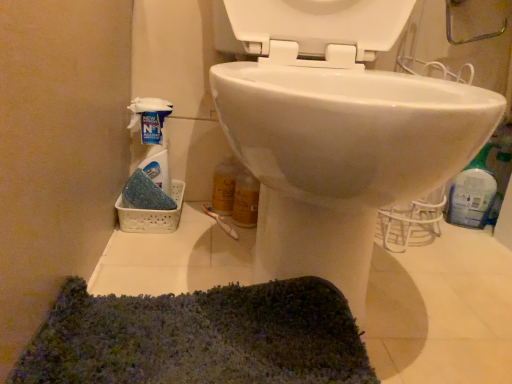
Locate an element on the screen. blue plastic bottle at right, which is counted as the 1th cleaning product, starting from the right is located at coordinates [x=472, y=193].

I want to click on white glossy toilet at center, so click(x=337, y=132).

In terms of width, does blue plastic bottle at right, which appears as the second cleaning product when viewed from the left, look wider or thinner when compared to white glossy toilet at center?

Clearly, blue plastic bottle at right, which appears as the second cleaning product when viewed from the left, has less width compared to white glossy toilet at center.

Which of these two, blue plastic bottle at right, which is counted as the 1th cleaning product, starting from the right, or white glossy toilet at center, is smaller?

blue plastic bottle at right, which is counted as the 1th cleaning product, starting from the right.

Visually, is blue plastic bottle at right, which appears as the second cleaning product when viewed from the left, positioned to the left or to the right of white glossy toilet at center?

Clearly, blue plastic bottle at right, which appears as the second cleaning product when viewed from the left, is on the right of white glossy toilet at center in the image.

Who is smaller, white plastic spray bottle at left, which is the second cleaning product in right-to-left order, or blue plastic bottle at right, which is counted as the 1th cleaning product, starting from the right?

With smaller size is white plastic spray bottle at left, which is the second cleaning product in right-to-left order.

Does white plastic spray bottle at left, the first cleaning product positioned from the left, have a lesser width compared to blue plastic bottle at right, which is counted as the 1th cleaning product, starting from the right?

Yes.

From a real-world perspective, is white plastic spray bottle at left, the first cleaning product positioned from the left, physically located above or below blue plastic bottle at right, which is counted as the 1th cleaning product, starting from the right?

Clearly, from a real-world perspective, white plastic spray bottle at left, the first cleaning product positioned from the left, is below blue plastic bottle at right, which is counted as the 1th cleaning product, starting from the right.

Does white plastic spray bottle at left, which is the second cleaning product in right-to-left order, turn towards blue plastic bottle at right, which is counted as the 1th cleaning product, starting from the right?

No, white plastic spray bottle at left, which is the second cleaning product in right-to-left order, does not turn towards blue plastic bottle at right, which is counted as the 1th cleaning product, starting from the right.

From a real-world perspective, which is physically above, blue plastic bottle at right, which is counted as the 1th cleaning product, starting from the right, or white plastic spray bottle at left, which is the second cleaning product in right-to-left order?

In real-world perspective, blue plastic bottle at right, which is counted as the 1th cleaning product, starting from the right, is above.

Is blue plastic bottle at right, which appears as the second cleaning product when viewed from the left, oriented towards white plastic spray bottle at left, which is the second cleaning product in right-to-left order?

No.

Find the location of `cleaning product below the white plastic spray bottle at left, which is the second cleaning product in right-to-left order (from the image's perspective)`. cleaning product below the white plastic spray bottle at left, which is the second cleaning product in right-to-left order (from the image's perspective) is located at coordinates (472, 193).

Does point (328, 279) appear closer or farther from the camera than point (463, 217)?

Point (328, 279) is positioned closer to the camera compared to point (463, 217).

Is white glossy toilet at center directly adjacent to blue plastic bottle at right, which is counted as the 1th cleaning product, starting from the right?

white glossy toilet at center is not next to blue plastic bottle at right, which is counted as the 1th cleaning product, starting from the right, and they're not touching.

From the image's perspective, is white glossy toilet at center under blue plastic bottle at right, which appears as the second cleaning product when viewed from the left?

No.

Considering the relative sizes of white glossy toilet at center and blue plastic bottle at right, which appears as the second cleaning product when viewed from the left, in the image provided, is white glossy toilet at center thinner than blue plastic bottle at right, which appears as the second cleaning product when viewed from the left,?

Incorrect, the width of white glossy toilet at center is not less than that of blue plastic bottle at right, which appears as the second cleaning product when viewed from the left.

From the picture: Looking at the image, does white glossy toilet at center seem bigger or smaller compared to white plastic spray bottle at left, the first cleaning product positioned from the left?

Considering their sizes, white glossy toilet at center takes up more space than white plastic spray bottle at left, the first cleaning product positioned from the left.

In the image, is white glossy toilet at center positioned in front of or behind white plastic spray bottle at left, the first cleaning product positioned from the left?

Clearly, white glossy toilet at center is in front of white plastic spray bottle at left, the first cleaning product positioned from the left.

In the scene shown: Would you consider white glossy toilet at center to be distant from white plastic spray bottle at left, which is the second cleaning product in right-to-left order?

No, white glossy toilet at center is not far away from white plastic spray bottle at left, which is the second cleaning product in right-to-left order.

The height and width of the screenshot is (384, 512). I want to click on toilet that appears in front of the white plastic spray bottle at left, the first cleaning product positioned from the left, so click(337, 132).

Between white plastic spray bottle at left, which is the second cleaning product in right-to-left order, and white glossy toilet at center, which one has smaller size?

white plastic spray bottle at left, which is the second cleaning product in right-to-left order.

Does white plastic spray bottle at left, the first cleaning product positioned from the left, touch white glossy toilet at center?

white plastic spray bottle at left, the first cleaning product positioned from the left, is not next to white glossy toilet at center, and they're not touching.

From the image's perspective, is white plastic spray bottle at left, the first cleaning product positioned from the left, positioned above or below white glossy toilet at center?

From the image's perspective, white plastic spray bottle at left, the first cleaning product positioned from the left, appears below white glossy toilet at center.

From the white glossy toilet at center, count 2nd cleaning products backward and point to it. Please provide its 2D coordinates.

[(472, 193)]

The image size is (512, 384). What are the coordinates of `cleaning product on the left of blue plastic bottle at right, which is counted as the 1th cleaning product, starting from the right` in the screenshot? It's located at (151, 139).

Based on their spatial positions, is blue plastic bottle at right, which is counted as the 1th cleaning product, starting from the right, or white plastic spray bottle at left, which is the second cleaning product in right-to-left order, closer to white glossy toilet at center?

white plastic spray bottle at left, which is the second cleaning product in right-to-left order.

Looking at the image, which one is located closer to white glossy toilet at center, white plastic spray bottle at left, which is the second cleaning product in right-to-left order, or blue plastic bottle at right, which is counted as the 1th cleaning product, starting from the right?

white plastic spray bottle at left, which is the second cleaning product in right-to-left order, is closer to white glossy toilet at center.

When comparing their distances from white plastic spray bottle at left, the first cleaning product positioned from the left, does white glossy toilet at center or blue plastic bottle at right, which is counted as the 1th cleaning product, starting from the right, seem closer?

Based on the image, white glossy toilet at center appears to be nearer to white plastic spray bottle at left, the first cleaning product positioned from the left.

When comparing their distances from blue plastic bottle at right, which is counted as the 1th cleaning product, starting from the right, does white glossy toilet at center or white plastic spray bottle at left, which is the second cleaning product in right-to-left order, seem closer?

white glossy toilet at center is positioned closer to the anchor blue plastic bottle at right, which is counted as the 1th cleaning product, starting from the right.

From the image, which object appears to be nearer to white plastic spray bottle at left, which is the second cleaning product in right-to-left order, blue plastic bottle at right, which appears as the second cleaning product when viewed from the left, or white glossy toilet at center?

Among the two, white glossy toilet at center is located nearer to white plastic spray bottle at left, which is the second cleaning product in right-to-left order.

Estimate the real-world distances between objects in this image. Which object is closer to blue plastic bottle at right, which is counted as the 1th cleaning product, starting from the right, white plastic spray bottle at left, which is the second cleaning product in right-to-left order, or white glossy toilet at center?

white glossy toilet at center is positioned closer to the anchor blue plastic bottle at right, which is counted as the 1th cleaning product, starting from the right.

At what (x,y) coordinates should I click in order to perform the action: click on toilet between white plastic spray bottle at left, which is the second cleaning product in right-to-left order, and blue plastic bottle at right, which is counted as the 1th cleaning product, starting from the right. Please return your answer as a coordinate pair (x, y). This screenshot has width=512, height=384. Looking at the image, I should click on tap(337, 132).